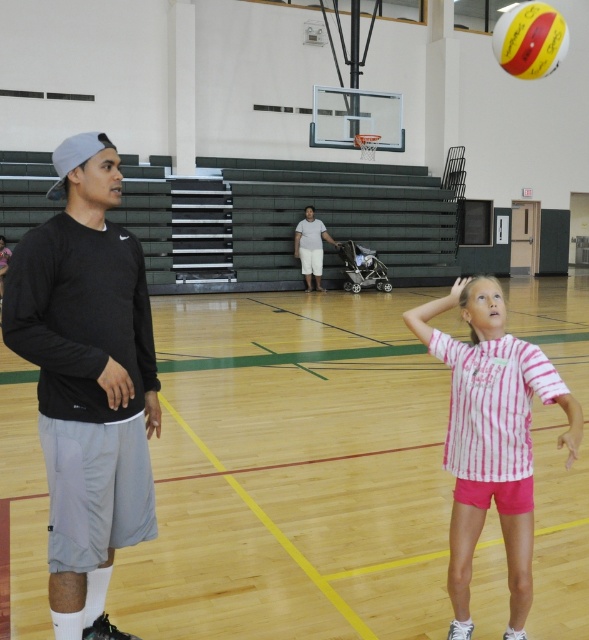
Which of these two, black matte long-sleeve shirt at left or pink striped shirt at center, stands shorter?

pink striped shirt at center is shorter.

Is black matte long-sleeve shirt at left closer to the viewer compared to pink striped shirt at center?

Yes.

Does point (59, 161) come behind point (508, 349)?

No, it is in front of (508, 349).

Image resolution: width=589 pixels, height=640 pixels. Find the location of `black matte long-sleeve shirt at left`. black matte long-sleeve shirt at left is located at coordinates (87, 380).

Which of these two, black matte long-sleeve shirt at left or white cotton shirt at center, stands taller?

black matte long-sleeve shirt at left is taller.

Does black matte long-sleeve shirt at left appear under white cotton shirt at center?

Yes, black matte long-sleeve shirt at left is below white cotton shirt at center.

Is point (134, 275) behind point (309, 284)?

No, (134, 275) is closer to viewer.

Image resolution: width=589 pixels, height=640 pixels. What are the coordinates of `black matte long-sleeve shirt at left` in the screenshot? It's located at (87, 380).

Which is more to the right, black matte long-sleeve shirt at left or yellow matte volleyball at upper right?

Positioned to the right is yellow matte volleyball at upper right.

Is black matte long-sleeve shirt at left shorter than yellow matte volleyball at upper right?

No, black matte long-sleeve shirt at left is not shorter than yellow matte volleyball at upper right.

Is point (124, 292) more distant than point (538, 74)?

No, (124, 292) is closer to viewer.

Find the location of a particular element. This screenshot has width=589, height=640. black matte long-sleeve shirt at left is located at coordinates (87, 380).